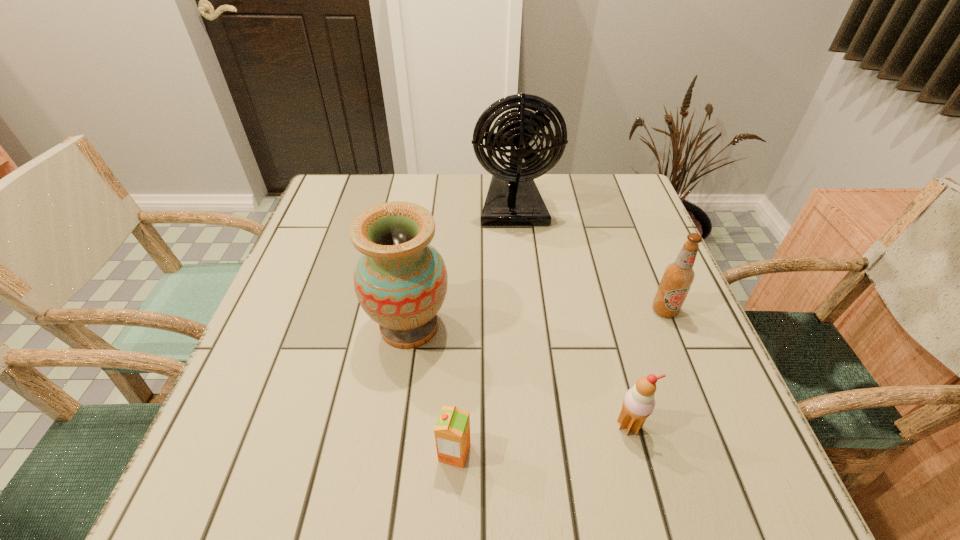
Image resolution: width=960 pixels, height=540 pixels. Find the location of `fan`. fan is located at coordinates (513, 199).

Find the location of a particular element. Image resolution: width=960 pixels, height=540 pixels. the tallest object is located at coordinates (513, 199).

Locate an element on the screen. the second tallest object is located at coordinates [x=400, y=281].

Locate an element on the screen. This screenshot has width=960, height=540. beer bottle is located at coordinates (678, 277).

Where is `the rightmost object`? This screenshot has height=540, width=960. the rightmost object is located at coordinates (678, 277).

Image resolution: width=960 pixels, height=540 pixels. Find the location of `the second object from right to left`. the second object from right to left is located at coordinates (639, 402).

Find the location of a particular element. This screenshot has width=960, height=540. icecream is located at coordinates (639, 402).

In order to click on the shortest object in this screenshot , I will do `click(452, 431)`.

This screenshot has height=540, width=960. I want to click on vacant space located in front of the farthest object to blow air, so click(x=527, y=352).

Where is `vacant area located on the front of the fourth shortest object`? This screenshot has width=960, height=540. vacant area located on the front of the fourth shortest object is located at coordinates [397, 407].